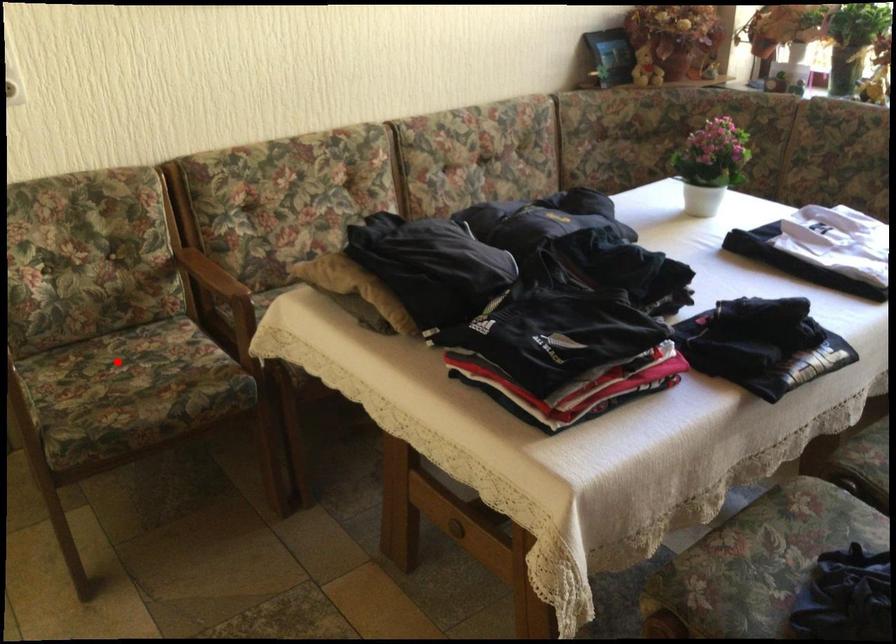
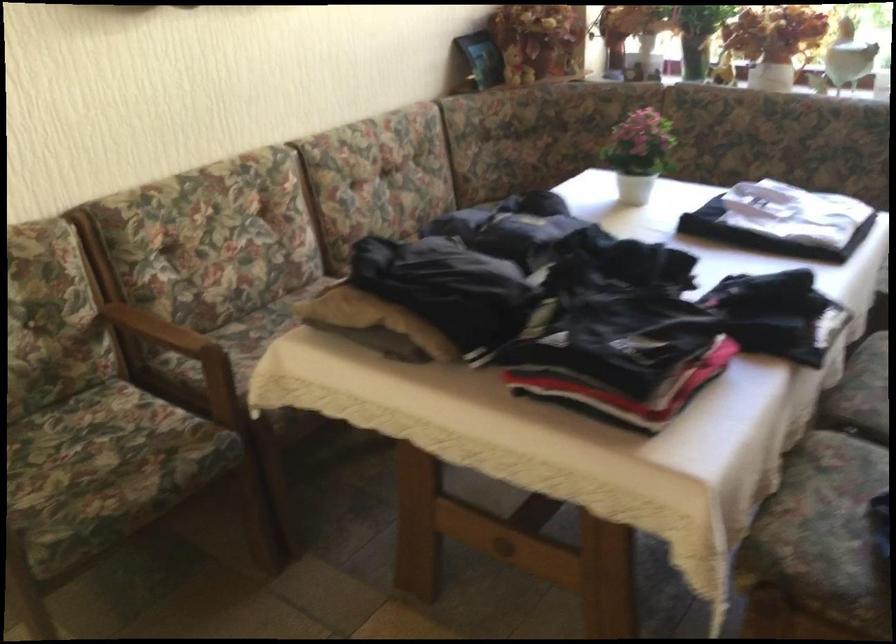
Locate, in the second image, the point that corresponds to the highlighted location in the first image.

(67, 444)